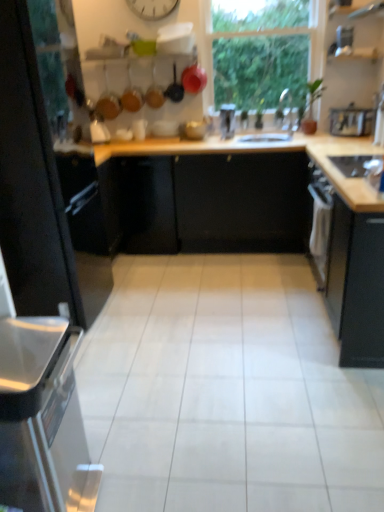
Question: In terms of width, does black matte cabinet at left, which ranks as the 1th cabinetry in left-to-right order, look wider or thinner when compared to black matte cabinet at right, which is the 2th cabinetry in left-to-right order?

Choices:
 (A) thin
 (B) wide

Answer: (B)

Question: Based on their sizes in the image, would you say black matte cabinet at left, the second cabinetry in the right-to-left sequence, is bigger or smaller than black matte cabinet at right, the first cabinetry from the right?

Choices:
 (A) big
 (B) small

Answer: (A)

Question: Based on their relative distances, which object is farther from the metallic silver toaster at upper right, the 4th appliance in the back-to-front sequence?

Choices:
 (A) satin silver dishwasher at left
 (B) matte black frying pan at upper center, acting as the 3th frying pan starting from the right
 (C) white plastic clock at upper center
 (D) metallic silver toaster at center, the second appliance viewed from the back
 (E) matte black frying pan at upper center, the 1th frying pan in the right-to-left sequence

Answer: (A)

Question: Which object is positioned closest to the satin silver dishwasher at left?

Choices:
 (A) white plastic clock at upper center
 (B) metallic silver kettle at upper right, the 1th appliance from the right
 (C) matte black frying pan at upper center, which appears as the second frying pan when viewed from the right
 (D) white glossy kettle at upper left, acting as the fourth appliance starting from the top
 (E) black glass stove at right, positioned as the 1th appliance in front-to-back order

Answer: (E)